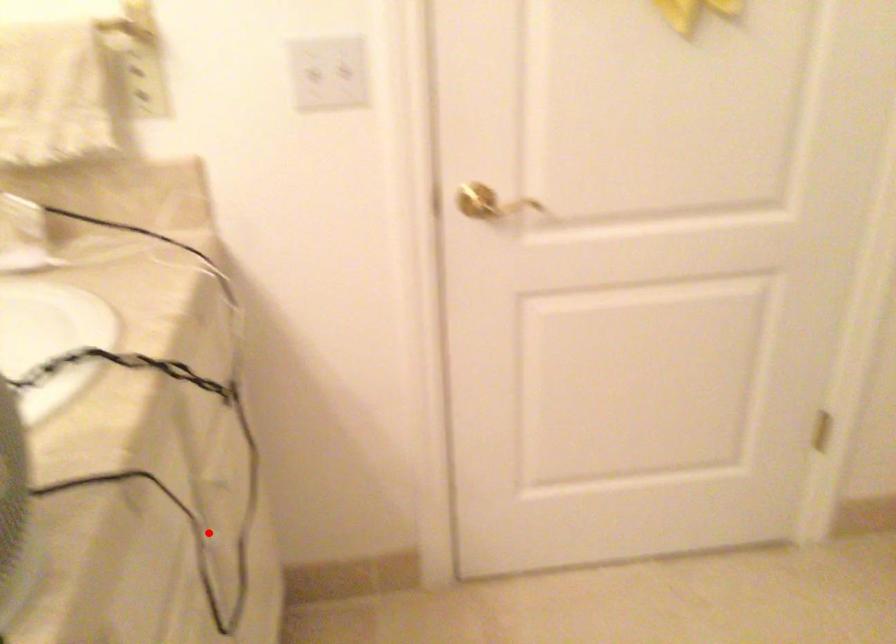
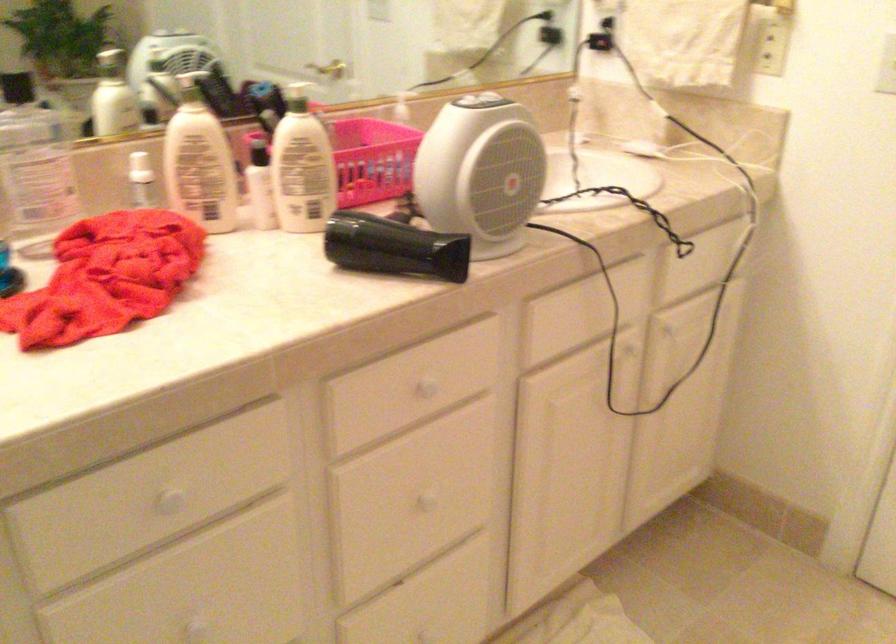
Locate, in the second image, the point that corresponds to the highlighted location in the first image.

(625, 348)